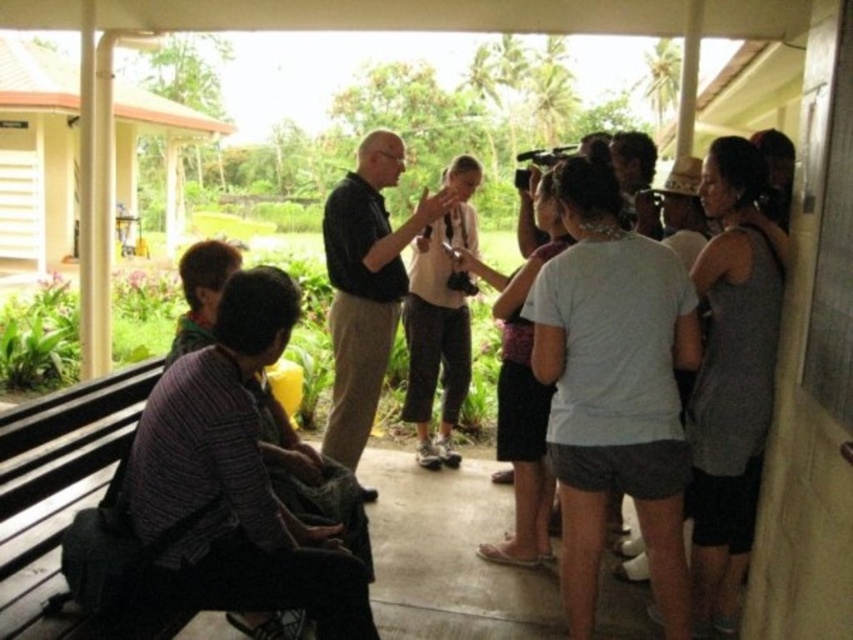
Question: Is wooden bench at lower left bigger than black matte shirt at center?

Choices:
 (A) yes
 (B) no

Answer: (B)

Question: Is wooden bench at lower left below black matte shirt at center?

Choices:
 (A) no
 (B) yes

Answer: (B)

Question: Can you confirm if wooden bench at lower left is thinner than black matte shirt at center?

Choices:
 (A) no
 (B) yes

Answer: (B)

Question: Which point is farther to the camera?

Choices:
 (A) wooden bench at lower left
 (B) black matte shirt at center

Answer: (B)

Question: Which point is closer to the camera taking this photo?

Choices:
 (A) (340, 401)
 (B) (1, 484)

Answer: (B)